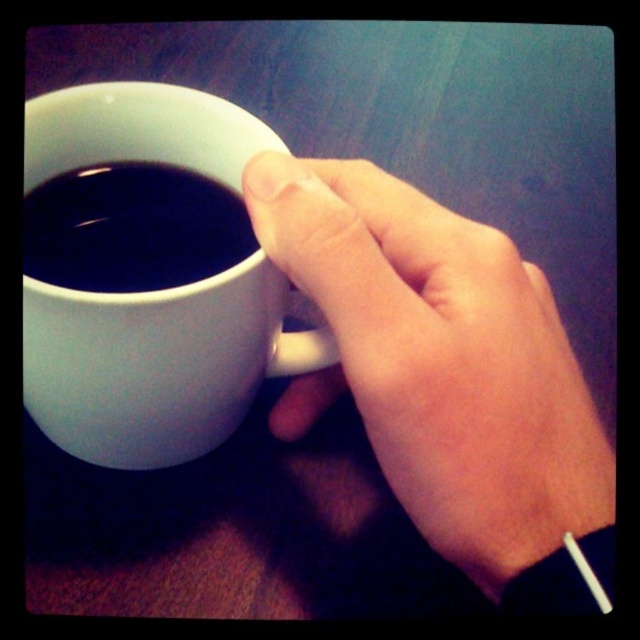
Can you confirm if smooth skin hand at upper center is smaller than white matte mug at center?

Yes, smooth skin hand at upper center is smaller than white matte mug at center.

Is point (520, 289) behind point (182, 362)?

No.

Between point (483, 440) and point (152, 400), which one is positioned behind?

Positioned behind is point (152, 400).

Locate an element on the screen. Image resolution: width=640 pixels, height=640 pixels. smooth skin hand at upper center is located at coordinates (438, 362).

Does smooth skin hand at upper center appear on the left side of black glossy mug at upper center?

No, smooth skin hand at upper center is not to the left of black glossy mug at upper center.

Who is more distant from viewer, [509,477] or [156,189]?

Point [156,189]

You are a GUI agent. You are given a task and a screenshot of the screen. Output one action in this format:
    pyautogui.click(x=<x>, y=<y>)
    Task: Click on the smooth skin hand at upper center
    This screenshot has width=640, height=640.
    Given the screenshot: What is the action you would take?
    pyautogui.click(x=438, y=362)

Does white matte mug at center appear on the right side of black glossy mug at upper center?

Yes, white matte mug at center is to the right of black glossy mug at upper center.

This screenshot has height=640, width=640. What do you see at coordinates (156, 364) in the screenshot?
I see `white matte mug at center` at bounding box center [156, 364].

Where is `white matte mug at center`? white matte mug at center is located at coordinates point(156,364).